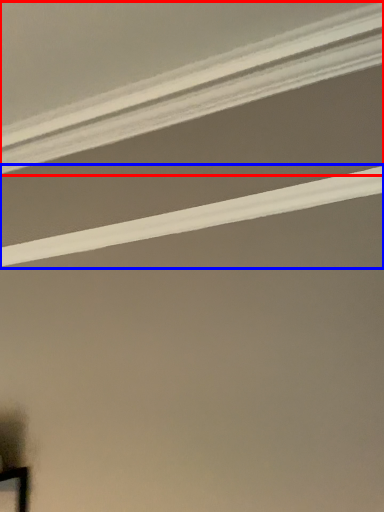
Question: Which object appears closest to the camera in this image, strip (highlighted by a red box) or strip (highlighted by a blue box)?

Choices:
 (A) strip
 (B) strip

Answer: (A)